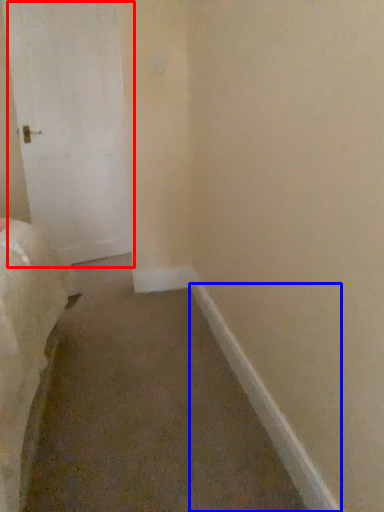
Question: Which object is closer to the camera taking this photo, door (highlighted by a red box) or molding (highlighted by a blue box)?

Choices:
 (A) door
 (B) molding

Answer: (B)